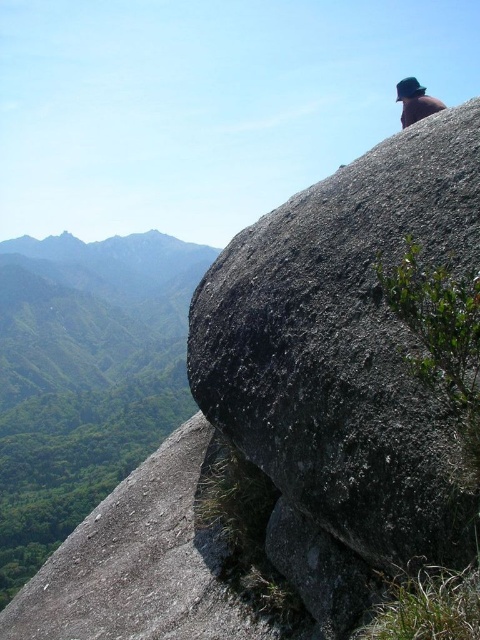
Question: Does gray rough boulder at upper right have a smaller size compared to green felt hat at upper right?

Choices:
 (A) yes
 (B) no

Answer: (A)

Question: Is gray rough boulder at upper right to the left of green felt hat at upper right from the viewer's perspective?

Choices:
 (A) no
 (B) yes

Answer: (B)

Question: Is gray rough boulder at upper right wider than green felt hat at upper right?

Choices:
 (A) yes
 (B) no

Answer: (B)

Question: Which object appears closest to the camera in this image?

Choices:
 (A) gray rough boulder at upper right
 (B) green felt hat at upper right

Answer: (A)

Question: Which point is farther to the camera?

Choices:
 (A) gray rough boulder at upper right
 (B) green felt hat at upper right

Answer: (B)